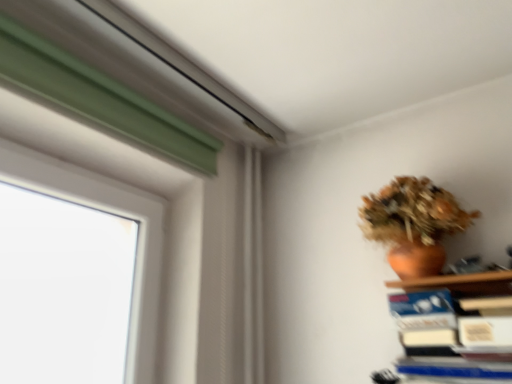
This screenshot has width=512, height=384. What do you see at coordinates (453, 368) in the screenshot? I see `blue hardcover book at lower right` at bounding box center [453, 368].

You are a GUI agent. You are given a task and a screenshot of the screen. Output one action in this format:
    pyautogui.click(x=<x>, y=<y>)
    Task: Click on the blue hardcover book at lower right
    
    Given the screenshot: What is the action you would take?
    pyautogui.click(x=453, y=368)

You are a GUI agent. You are given a task and a screenshot of the screen. Output one action in this format:
    pyautogui.click(x=<x>, y=<y>)
    Task: Click on the terracotta clay vase at upper right
    This screenshot has width=512, height=384.
    Given the screenshot: What is the action you would take?
    pyautogui.click(x=413, y=224)

Image resolution: width=512 pixels, height=384 pixels. What do you see at coordinates (413, 224) in the screenshot?
I see `terracotta clay vase at upper right` at bounding box center [413, 224].

Find the location of `blue hardcover book at lower right`. blue hardcover book at lower right is located at coordinates (453, 368).

Is terracotta clay vase at upper right at the left side of blue hardcover book at lower right?

Indeed, terracotta clay vase at upper right is positioned on the left side of blue hardcover book at lower right.

Is terracotta clay vase at upper right further to the viewer compared to blue hardcover book at lower right?

Yes.

Considering the positions of points (438, 193) and (486, 376), is point (438, 193) farther from camera compared to point (486, 376)?

Yes, point (438, 193) is behind point (486, 376).

From the image's perspective, is terracotta clay vase at upper right over blue hardcover book at lower right?

Indeed, from the image's perspective, terracotta clay vase at upper right is shown above blue hardcover book at lower right.

From a real-world perspective, does terracotta clay vase at upper right stand above blue hardcover book at lower right?

Correct, in the physical world, terracotta clay vase at upper right is higher than blue hardcover book at lower right.

Is terracotta clay vase at upper right wider than blue hardcover book at lower right?

Correct, the width of terracotta clay vase at upper right exceeds that of blue hardcover book at lower right.

Is terracotta clay vase at upper right shorter than blue hardcover book at lower right?

Incorrect, the height of terracotta clay vase at upper right does not fall short of that of blue hardcover book at lower right.

Which of these two, terracotta clay vase at upper right or blue hardcover book at lower right, is bigger?

Bigger between the two is terracotta clay vase at upper right.

Is blue hardcover book at lower right completely or partially inside terracotta clay vase at upper right?

No, blue hardcover book at lower right is not inside terracotta clay vase at upper right.

Are terracotta clay vase at upper right and blue hardcover book at lower right located far from each other?

terracotta clay vase at upper right is near blue hardcover book at lower right, not far away.

Is terracotta clay vase at upper right aimed at blue hardcover book at lower right?

No, terracotta clay vase at upper right does not turn towards blue hardcover book at lower right.

This screenshot has height=384, width=512. Identify the location of paperback book on the right of terracotta clay vase at upper right. (453, 368).

Can you confirm if blue hardcover book at lower right is positioned to the right of terracotta clay vase at upper right?

Correct, you'll find blue hardcover book at lower right to the right of terracotta clay vase at upper right.

Is the depth of blue hardcover book at lower right less than that of terracotta clay vase at upper right?

Yes, blue hardcover book at lower right is closer to the viewer.

Considering the points (501, 371) and (391, 226), which point is behind, point (501, 371) or point (391, 226)?

The point (391, 226) is more distant.

From the image's perspective, relative to terracotta clay vase at upper right, is blue hardcover book at lower right above or below?

Based on their image positions, blue hardcover book at lower right is located beneath terracotta clay vase at upper right.

From a real-world perspective, relative to terracotta clay vase at upper right, is blue hardcover book at lower right vertically above or below?

blue hardcover book at lower right is below terracotta clay vase at upper right.

In terms of width, does blue hardcover book at lower right look wider or thinner when compared to terracotta clay vase at upper right?

In the image, blue hardcover book at lower right appears to be more narrow than terracotta clay vase at upper right.

Based on the photo, does blue hardcover book at lower right have a greater height compared to terracotta clay vase at upper right?

Incorrect, the height of blue hardcover book at lower right is not larger of that of terracotta clay vase at upper right.

Considering the sizes of objects blue hardcover book at lower right and terracotta clay vase at upper right in the image provided, who is smaller, blue hardcover book at lower right or terracotta clay vase at upper right?

blue hardcover book at lower right is smaller.

Is blue hardcover book at lower right completely or partially outside of terracotta clay vase at upper right?

Indeed, blue hardcover book at lower right is completely outside terracotta clay vase at upper right.

Is blue hardcover book at lower right far away from terracotta clay vase at upper right?

No, there isn't a large distance between blue hardcover book at lower right and terracotta clay vase at upper right.

Is blue hardcover book at lower right aimed at terracotta clay vase at upper right?

No.

How far apart are blue hardcover book at lower right and terracotta clay vase at upper right?

The distance of blue hardcover book at lower right from terracotta clay vase at upper right is 13.36 inches.

Locate an element on the screen. This screenshot has height=384, width=512. houseplant behind the blue hardcover book at lower right is located at coordinates (413, 224).

The height and width of the screenshot is (384, 512). In order to click on paperback book directly beneath the terracotta clay vase at upper right (from a real-world perspective) in this screenshot , I will do `click(453, 368)`.

Where is `paperback book in front of the terracotta clay vase at upper right`? paperback book in front of the terracotta clay vase at upper right is located at coordinates (453, 368).